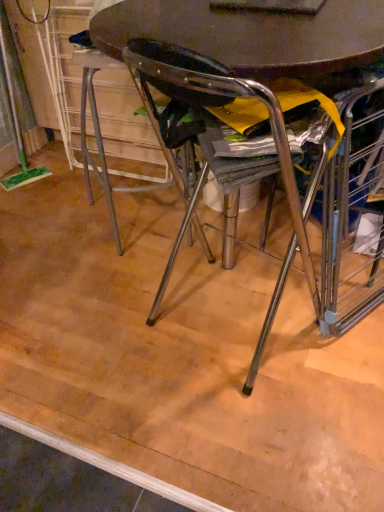
Locate an element on the screen. The image size is (384, 512). vacant space situated above matte wood floor at center (from a real-world perspective) is located at coordinates [127, 288].